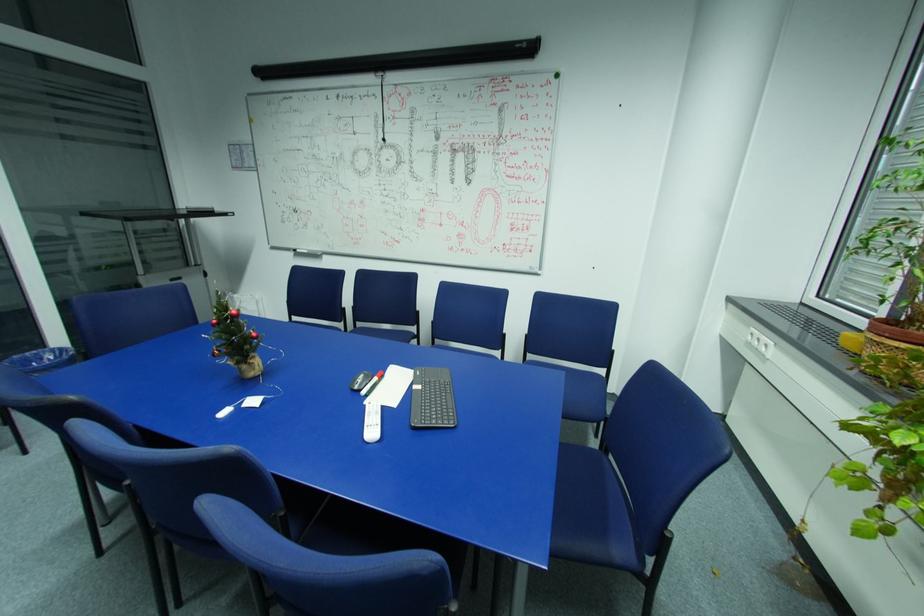
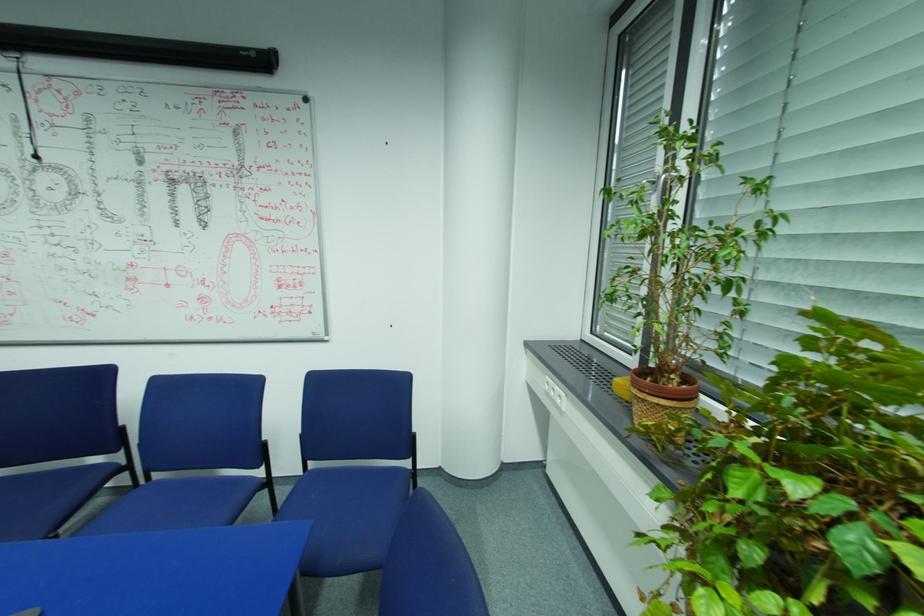
Question: How did the camera likely rotate?

Choices:
 (A) Left
 (B) Right
 (C) Up
 (D) Down

Answer: (B)